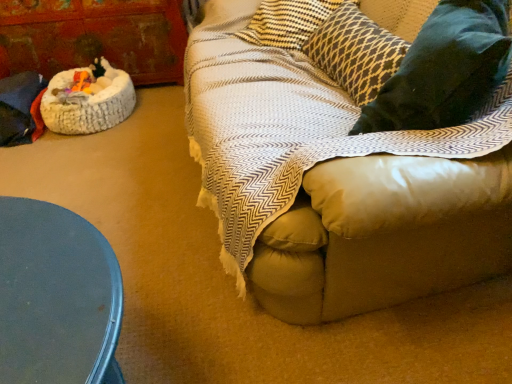
The width and height of the screenshot is (512, 384). Describe the element at coordinates (88, 99) in the screenshot. I see `white fluffy cat bed at left` at that location.

Where is `rustic wood armoire at left`? rustic wood armoire at left is located at coordinates (94, 37).

Is rustic wood armoire at left to the right of white fluffy cat bed at left from the viewer's perspective?

No, rustic wood armoire at left is not to the right of white fluffy cat bed at left.

Would you say rustic wood armoire at left is inside or outside white fluffy cat bed at left?

rustic wood armoire at left exists outside the volume of white fluffy cat bed at left.

Which is further, (120,28) or (52,99)?

The point (120,28) is farther.

From the image's perspective, between rustic wood armoire at left and white fluffy cat bed at left, which one is located above?

rustic wood armoire at left, from the image's perspective.

Is velvety dark green pillow at right shorter than dark gray textured pillow at upper right?

No, velvety dark green pillow at right is not shorter than dark gray textured pillow at upper right.

From the image's perspective, which one is positioned higher, velvety dark green pillow at right or dark gray textured pillow at upper right?

From the image's view, dark gray textured pillow at upper right is above.

Considering the sizes of velvety dark green pillow at right and dark gray textured pillow at upper right in the image, is velvety dark green pillow at right bigger or smaller than dark gray textured pillow at upper right?

Considering their sizes, velvety dark green pillow at right takes up more space than dark gray textured pillow at upper right.

Choose the correct answer: Is velvety dark green pillow at right inside dark gray textured pillow at upper right or outside it?

velvety dark green pillow at right is outside dark gray textured pillow at upper right.

Where is `armoire behind the white fluffy cat bed at left`? Image resolution: width=512 pixels, height=384 pixels. armoire behind the white fluffy cat bed at left is located at coordinates (94, 37).

Is white fluffy cat bed at left not within rustic wood armoire at left?

That's correct, white fluffy cat bed at left is outside of rustic wood armoire at left.

What's the angular difference between white fluffy cat bed at left and rustic wood armoire at left's facing directions?

0.531 degrees separate the facing orientations of white fluffy cat bed at left and rustic wood armoire at left.

Does point (85, 86) lie behind point (336, 73)?

Yes, point (85, 86) is behind point (336, 73).

Considering the sizes of objects white fluffy cat bed at left and dark gray textured pillow at upper right in the image provided, who is bigger, white fluffy cat bed at left or dark gray textured pillow at upper right?

With larger size is dark gray textured pillow at upper right.

How far apart are white fluffy cat bed at left and dark gray textured pillow at upper right?

white fluffy cat bed at left and dark gray textured pillow at upper right are 1.09 meters apart.

Is white fluffy cat bed at left not close to dark gray textured pillow at upper right?

Yes.

Consider the image. How different are the orientations of rustic wood armoire at left and velvety dark green pillow at right in degrees?

There is a 111-degree angle between the facing directions of rustic wood armoire at left and velvety dark green pillow at right.

From the image's perspective, is rustic wood armoire at left on velvety dark green pillow at right?

Yes, from the image's perspective, rustic wood armoire at left is above velvety dark green pillow at right.

Is rustic wood armoire at left facing towards velvety dark green pillow at right?

Yes, rustic wood armoire at left is turned towards velvety dark green pillow at right.

From a real-world perspective, between rustic wood armoire at left and velvety dark green pillow at right, who is vertically lower?

rustic wood armoire at left is physically lower.

From the image's perspective, between dark gray textured pillow at upper right and white fluffy cat bed at left, who is located below?

From the image's view, white fluffy cat bed at left is below.

Between dark gray textured pillow at upper right and white fluffy cat bed at left, which one has larger size?

dark gray textured pillow at upper right is bigger.

Would you say dark gray textured pillow at upper right contains white fluffy cat bed at left?

No, white fluffy cat bed at left is located outside of dark gray textured pillow at upper right.

Which object is wider, white fluffy cat bed at left or velvety dark green pillow at right?

white fluffy cat bed at left is wider.

Can you confirm if white fluffy cat bed at left is smaller than velvety dark green pillow at right?

Yes.

Which object is further away from the camera, white fluffy cat bed at left or velvety dark green pillow at right?

Positioned behind is white fluffy cat bed at left.

Find the location of `armoire behind the white fluffy cat bed at left`. armoire behind the white fluffy cat bed at left is located at coordinates pyautogui.click(x=94, y=37).

Locate an element on the screen. The width and height of the screenshot is (512, 384). pillow on the left of velvety dark green pillow at right is located at coordinates (355, 52).

From the image, which object appears to be nearer to white fluffy cat bed at left, dark gray textured pillow at upper right or velvety dark green pillow at right?

The object closer to white fluffy cat bed at left is dark gray textured pillow at upper right.

Looking at the image, which one is located closer to dark gray textured pillow at upper right, white fluffy cat bed at left or velvety dark green pillow at right?

velvety dark green pillow at right.

When comparing their distances from velvety dark green pillow at right, does white fluffy cat bed at left or dark gray textured pillow at upper right seem further?

white fluffy cat bed at left is further to velvety dark green pillow at right.

From the image, which object appears to be farther from white fluffy cat bed at left, velvety dark green pillow at right or dark gray textured pillow at upper right?

velvety dark green pillow at right.

Based on their spatial positions, is rustic wood armoire at left or white fluffy cat bed at left closer to dark gray textured pillow at upper right?

Among the two, white fluffy cat bed at left is located nearer to dark gray textured pillow at upper right.

When comparing their distances from rustic wood armoire at left, does velvety dark green pillow at right or dark gray textured pillow at upper right seem closer?

dark gray textured pillow at upper right lies closer to rustic wood armoire at left than the other object.

Estimate the real-world distances between objects in this image. Which object is further from rustic wood armoire at left, velvety dark green pillow at right or white fluffy cat bed at left?

Among the two, velvety dark green pillow at right is located further to rustic wood armoire at left.

From the image, which object appears to be farther from dark gray textured pillow at upper right, velvety dark green pillow at right or white fluffy cat bed at left?

Based on the image, white fluffy cat bed at left appears to be further to dark gray textured pillow at upper right.

At what (x,y) coordinates should I click in order to perform the action: click on cat bed between rustic wood armoire at left and dark gray textured pillow at upper right from left to right. Please return your answer as a coordinate pair (x, y). The width and height of the screenshot is (512, 384). Looking at the image, I should click on (88, 99).

The width and height of the screenshot is (512, 384). Identify the location of cat bed located between rustic wood armoire at left and velvety dark green pillow at right in the left-right direction. (88, 99).

Locate an element on the screen. pillow between white fluffy cat bed at left and velvety dark green pillow at right in the horizontal direction is located at coordinates (355, 52).

The width and height of the screenshot is (512, 384). I want to click on pillow located between rustic wood armoire at left and velvety dark green pillow at right in the left-right direction, so click(x=355, y=52).